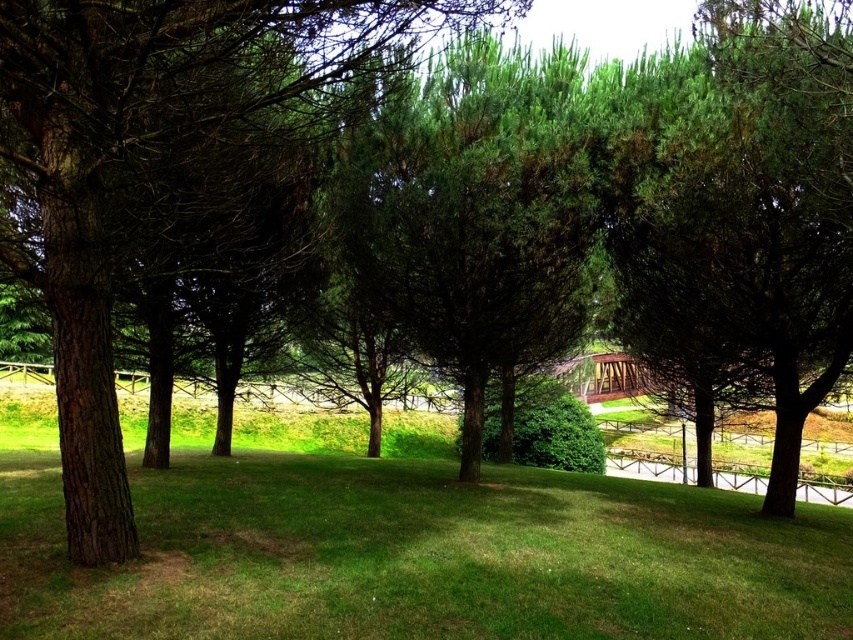
You are standing at the origin point in the park scene. A treasure map indicates that the treasure is buried at the coordinates given for the green grassy at center. What are the exact coordinates where you should dig?

The exact coordinates for the green grassy at center are at point (x=419, y=556), so you should dig there.

You are standing at the point marked as point [419,556] in the park scene. What type of ground surface are you currently standing on?

The point [419,556] is on green grassy at center, so you are standing on green grassy ground.

You are standing in the park and want to walk from the point at coordinates point [27,515] to the point at coordinates point [91,324]. Since you are facing the scene, which direction should you move to get closer to your destination?

Since point [27,515] is further to the camera than point [91,324], you should move forward towards the scene to get closer to your destination.